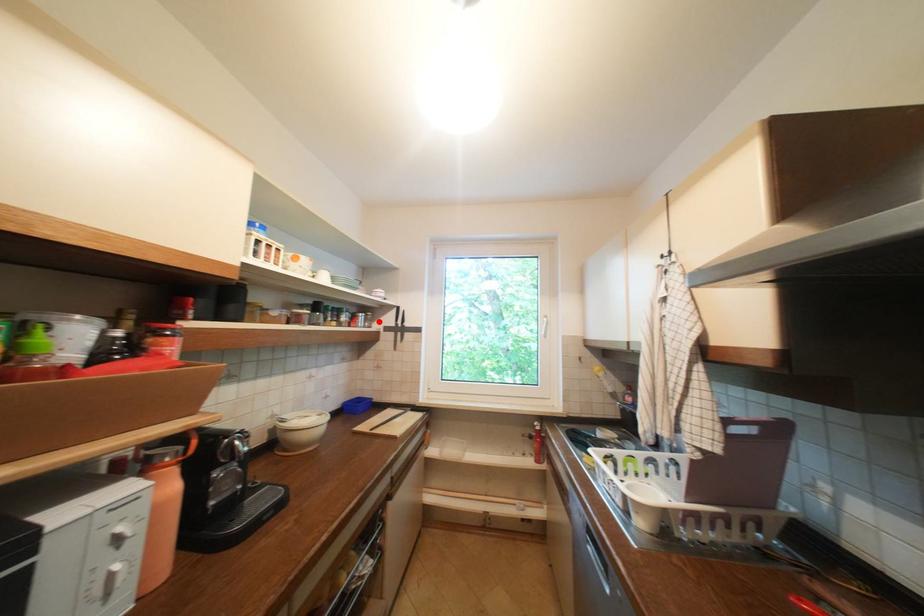
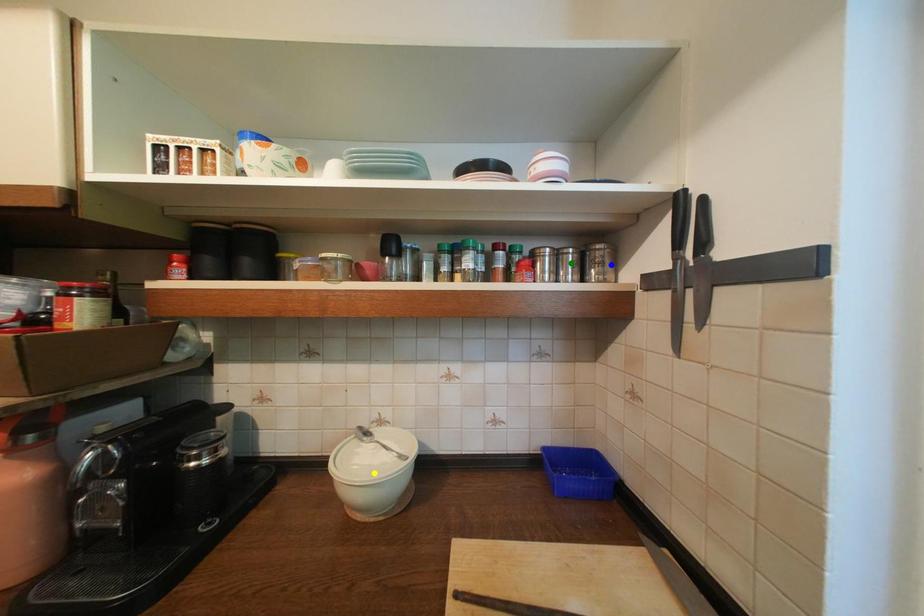
Question: I am providing you with two images of the same scene from different viewpoints. A red point is marked on the first image. You are given multiple points on the second image. Which spot in image 2 lines up with the point in image 1?

Choices:
 (A) blue point
 (B) yellow point
 (C) green point

Answer: (A)